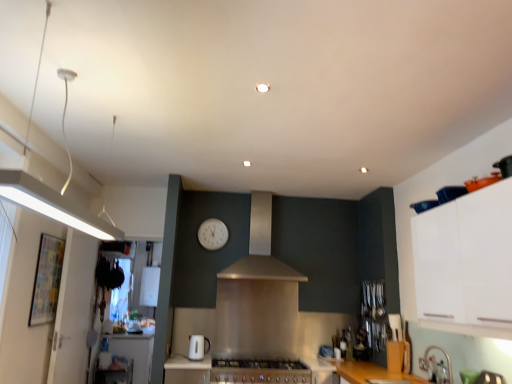
Question: Should I look upward or downward to see satin silver hood at center?

Choices:
 (A) down
 (B) up

Answer: (A)

Question: Is the depth of metallic stainless steel countertop at lower center greater than that of white glossy counter top at lower left?

Choices:
 (A) yes
 (B) no

Answer: (B)

Question: Can you confirm if metallic stainless steel countertop at lower center is shorter than white glossy counter top at lower left?

Choices:
 (A) no
 (B) yes

Answer: (B)

Question: Are metallic stainless steel countertop at lower center and white glossy counter top at lower left located far from each other?

Choices:
 (A) yes
 (B) no

Answer: (A)

Question: From a real-world perspective, is metallic stainless steel countertop at lower center physically below white glossy counter top at lower left?

Choices:
 (A) no
 (B) yes

Answer: (A)

Question: Can you confirm if metallic stainless steel countertop at lower center is positioned to the left of white glossy counter top at lower left?

Choices:
 (A) no
 (B) yes

Answer: (A)

Question: Is white glossy counter top at lower left at the back of metallic stainless steel countertop at lower center?

Choices:
 (A) no
 (B) yes

Answer: (A)

Question: Does white glossy counter top at lower left have a lesser width compared to metallic stainless steel countertop at lower center?

Choices:
 (A) no
 (B) yes

Answer: (A)

Question: Is white glossy counter top at lower left outside of metallic stainless steel countertop at lower center?

Choices:
 (A) no
 (B) yes

Answer: (B)

Question: Can you confirm if white glossy counter top at lower left is bigger than metallic stainless steel countertop at lower center?

Choices:
 (A) no
 (B) yes

Answer: (B)

Question: Is white glossy counter top at lower left positioned in front of metallic stainless steel countertop at lower center?

Choices:
 (A) yes
 (B) no

Answer: (B)

Question: From the image's perspective, does white glossy counter top at lower left appear lower than metallic stainless steel countertop at lower center?

Choices:
 (A) no
 (B) yes

Answer: (B)

Question: Is white glossy counter top at lower left turned away from metallic stainless steel countertop at lower center?

Choices:
 (A) no
 (B) yes

Answer: (A)

Question: Can you confirm if white glossy toaster at lower center is bigger than metallic stainless steel countertop at lower center?

Choices:
 (A) yes
 (B) no

Answer: (B)